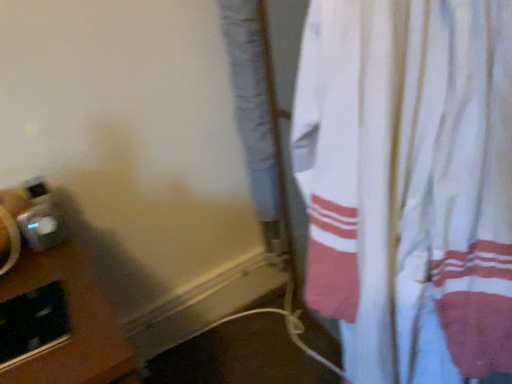
Where is `vacant space situated above brown wooden table at lower left (from a real-world perspective)`? This screenshot has width=512, height=384. vacant space situated above brown wooden table at lower left (from a real-world perspective) is located at coordinates (35, 296).